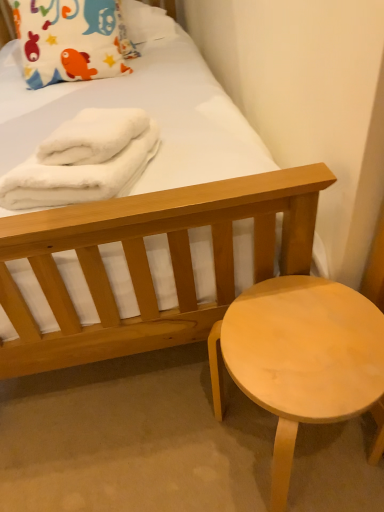
Question: Is white fluffy towel at upper left, which ranks as the second bath towel in left-to-right order, far away from white fluffy bath towel at upper left, marked as the 2th bath towel in a right-to-left arrangement?

Choices:
 (A) yes
 (B) no

Answer: (B)

Question: Is white fluffy towel at upper left, which ranks as the first bath towel in right-to-left order, aimed at white fluffy bath towel at upper left, marked as the 1th bath towel in a left-to-right arrangement?

Choices:
 (A) yes
 (B) no

Answer: (B)

Question: Does white fluffy towel at upper left, which ranks as the second bath towel in left-to-right order, touch white fluffy bath towel at upper left, marked as the 1th bath towel in a left-to-right arrangement?

Choices:
 (A) no
 (B) yes

Answer: (B)

Question: Does white fluffy towel at upper left, which ranks as the second bath towel in left-to-right order, have a lesser width compared to white fluffy bath towel at upper left, marked as the 2th bath towel in a right-to-left arrangement?

Choices:
 (A) no
 (B) yes

Answer: (B)

Question: Can you confirm if white fluffy towel at upper left, which ranks as the second bath towel in left-to-right order, is bigger than white fluffy bath towel at upper left, marked as the 2th bath towel in a right-to-left arrangement?

Choices:
 (A) no
 (B) yes

Answer: (A)

Question: Is white fluffy towel at upper left, which ranks as the second bath towel in left-to-right order, smaller than white fluffy bath towel at upper left, marked as the 2th bath towel in a right-to-left arrangement?

Choices:
 (A) no
 (B) yes

Answer: (B)

Question: Is white fluffy bath towel at upper left, marked as the 2th bath towel in a right-to-left arrangement, next to matte cotton pillow at upper left and touching it?

Choices:
 (A) no
 (B) yes

Answer: (A)

Question: Is white fluffy bath towel at upper left, marked as the 2th bath towel in a right-to-left arrangement, aimed at matte cotton pillow at upper left?

Choices:
 (A) yes
 (B) no

Answer: (B)

Question: Does white fluffy bath towel at upper left, marked as the 2th bath towel in a right-to-left arrangement, have a greater height compared to matte cotton pillow at upper left?

Choices:
 (A) yes
 (B) no

Answer: (B)

Question: From the image's perspective, is white fluffy bath towel at upper left, marked as the 2th bath towel in a right-to-left arrangement, on top of matte cotton pillow at upper left?

Choices:
 (A) no
 (B) yes

Answer: (A)

Question: Is white fluffy bath towel at upper left, marked as the 2th bath towel in a right-to-left arrangement, positioned beyond the bounds of matte cotton pillow at upper left?

Choices:
 (A) yes
 (B) no

Answer: (A)

Question: From the image's perspective, would you say white fluffy bath towel at upper left, marked as the 1th bath towel in a left-to-right arrangement, is shown under matte cotton pillow at upper left?

Choices:
 (A) yes
 (B) no

Answer: (A)

Question: Are light wood stool at lower right and matte cotton pillow at upper left far apart?

Choices:
 (A) yes
 (B) no

Answer: (A)